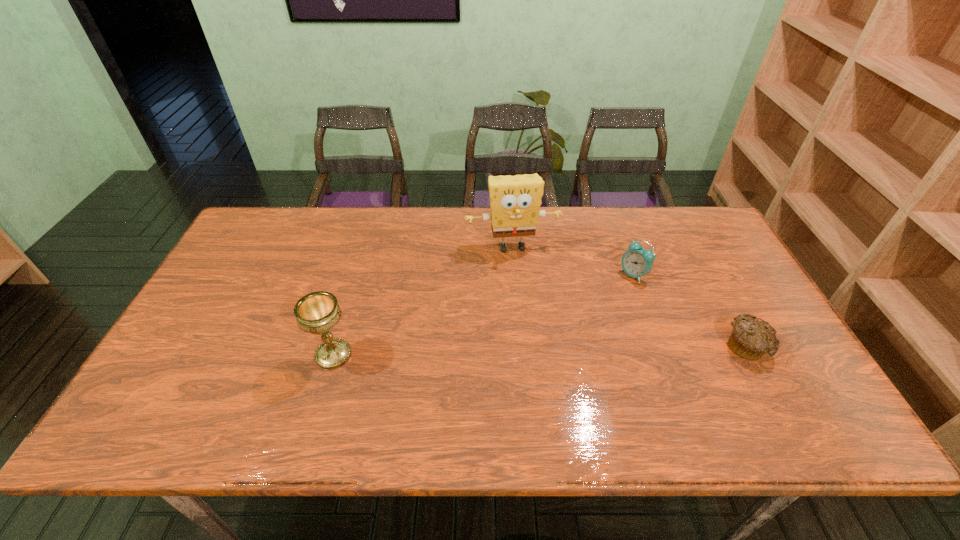
Where is `free location at the near edge`? free location at the near edge is located at coordinates (460, 396).

The image size is (960, 540). In the image, there is a desktop. Find the location of `vacant space at the left edge`. vacant space at the left edge is located at coordinates (260, 275).

Where is `vacant region at the right edge of the desktop`? The image size is (960, 540). vacant region at the right edge of the desktop is located at coordinates (694, 267).

You are a GUI agent. You are given a task and a screenshot of the screen. Output one action in this format:
    pyautogui.click(x=<x>, y=<y>)
    Task: Click on the free space at the far left corner
    
    Given the screenshot: What is the action you would take?
    pyautogui.click(x=291, y=222)

Identify the location of free space at the far right corner of the desktop. (708, 232).

The width and height of the screenshot is (960, 540). Find the location of `empty space that is in between the sponge and the second tallest object`. empty space that is in between the sponge and the second tallest object is located at coordinates (422, 301).

Identify the location of vacant area that lies between the chalice and the second object from left to right. The height and width of the screenshot is (540, 960). (422, 301).

The image size is (960, 540). Identify the location of vacant area that lies between the second tallest object and the alarm clock. (484, 315).

The image size is (960, 540). Find the location of `empty space between the shortest object and the chalice`. empty space between the shortest object and the chalice is located at coordinates (540, 351).

Locate an element on the screen. The width and height of the screenshot is (960, 540). vacant space that is in between the muffin and the second tallest object is located at coordinates (540, 351).